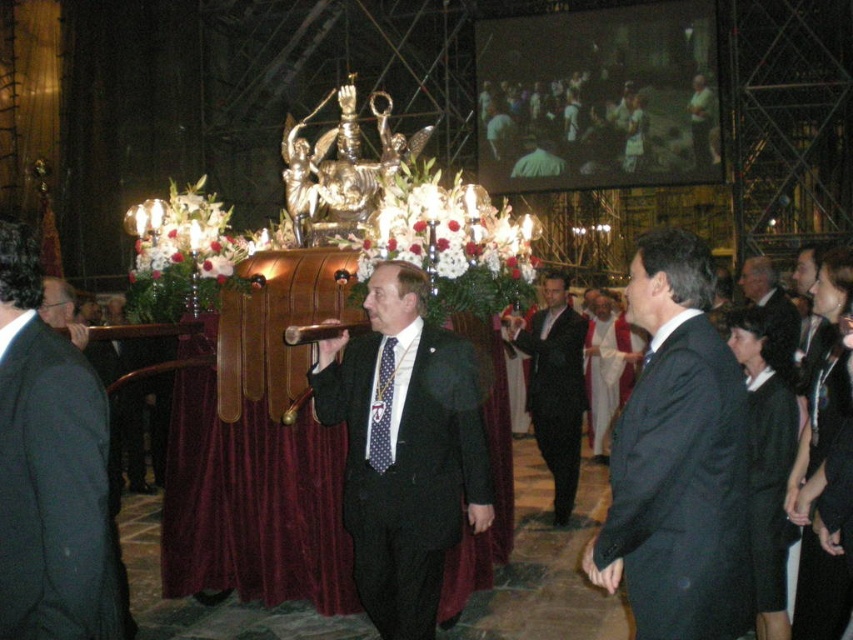
Is black suit at center thinner than black satin suit at center?

No.

Does black suit at center have a larger size compared to black satin suit at center?

Yes, black suit at center is bigger than black satin suit at center.

This screenshot has height=640, width=853. In order to click on black suit at center in this screenshot , I will do `click(677, 460)`.

Can you confirm if black suit at center is positioned to the left of dark suit at center?

Yes, black suit at center is to the left of dark suit at center.

Can you confirm if black suit at center is taller than dark suit at center?

Yes, black suit at center is taller than dark suit at center.

Is point (683, 259) positioned in front of point (761, 285)?

Yes, it is.

The image size is (853, 640). Identify the location of black suit at center. (677, 460).

Which is behind, point (97, 604) or point (373, 467)?

Positioned behind is point (373, 467).

Does dark gray suit at center appear under polka dot silk tie at center?

Yes, dark gray suit at center is below polka dot silk tie at center.

Which is behind, point (44, 388) or point (390, 360)?

Point (390, 360)

Locate an element on the screen. dark gray suit at center is located at coordinates (50, 470).